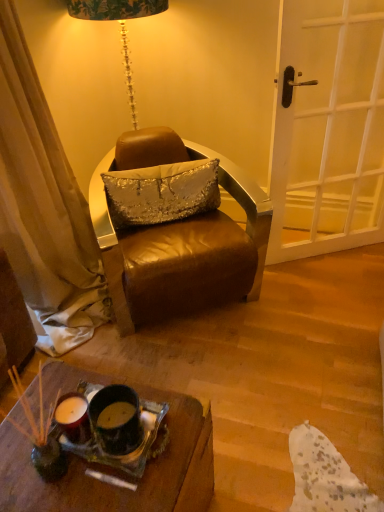
Question: Considering the relative sizes of translucent glass tray at lower center and white wooden door at right in the image provided, is translucent glass tray at lower center thinner than white wooden door at right?

Choices:
 (A) yes
 (B) no

Answer: (B)

Question: Would you say translucent glass tray at lower center is a long distance from white wooden door at right?

Choices:
 (A) yes
 (B) no

Answer: (A)

Question: From a real-world perspective, is translucent glass tray at lower center physically below white wooden door at right?

Choices:
 (A) no
 (B) yes

Answer: (B)

Question: Is translucent glass tray at lower center further to camera compared to white wooden door at right?

Choices:
 (A) no
 (B) yes

Answer: (A)

Question: Is translucent glass tray at lower center turned away from white wooden door at right?

Choices:
 (A) no
 (B) yes

Answer: (A)

Question: From a real-world perspective, is translucent glass tray at lower center positioned over white wooden door at right based on gravity?

Choices:
 (A) yes
 (B) no

Answer: (B)

Question: Would you say silver sequined pillow at center is part of white wooden door at right's contents?

Choices:
 (A) no
 (B) yes

Answer: (A)

Question: Can you confirm if white wooden door at right is wider than silver sequined pillow at center?

Choices:
 (A) yes
 (B) no

Answer: (B)

Question: Is the position of white wooden door at right more distant than that of silver sequined pillow at center?

Choices:
 (A) yes
 (B) no

Answer: (B)

Question: Is white wooden door at right directly adjacent to silver sequined pillow at center?

Choices:
 (A) yes
 (B) no

Answer: (B)

Question: Is white wooden door at right closer to camera compared to silver sequined pillow at center?

Choices:
 (A) yes
 (B) no

Answer: (A)

Question: Is white wooden door at right far away from silver sequined pillow at center?

Choices:
 (A) yes
 (B) no

Answer: (B)

Question: Is silver sequined pillow at center facing away from leather chair at center?

Choices:
 (A) yes
 (B) no

Answer: (A)